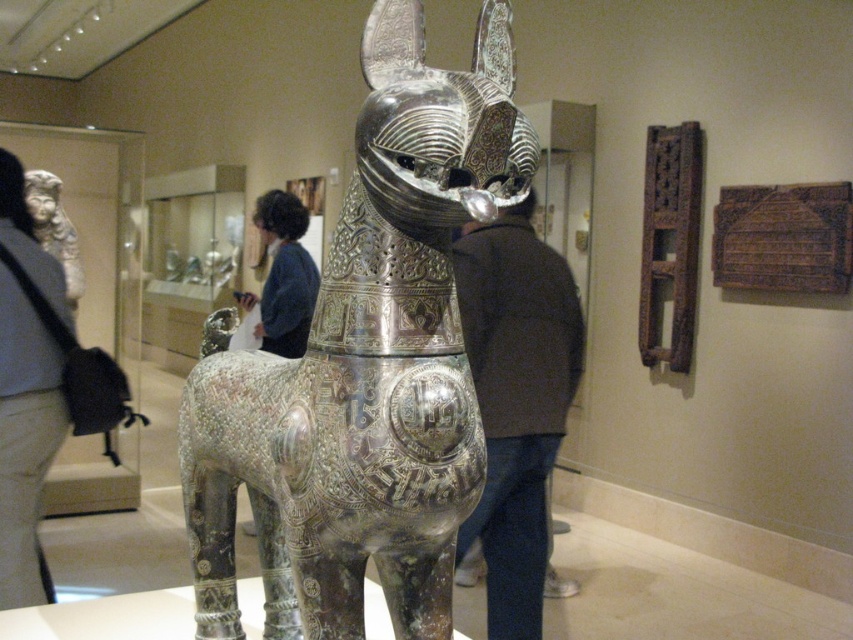
You are a GUI agent. You are given a task and a screenshot of the screen. Output one action in this format:
    pyautogui.click(x=<x>, y=<y>)
    Task: Click on the dark brown leather jacket at center
    
    Given the screenshot: What is the action you would take?
    pyautogui.click(x=515, y=401)

Can you confirm if dark brown leather jacket at center is thinner than light gray fabric jacket at upper left?

Incorrect, dark brown leather jacket at center's width is not less than light gray fabric jacket at upper left's.

This screenshot has width=853, height=640. Find the location of `dark brown leather jacket at center`. dark brown leather jacket at center is located at coordinates (515, 401).

Does dark brown leather jacket at center appear over dark blue sweater at center?

No.

From the picture: Can you confirm if dark brown leather jacket at center is positioned below dark blue sweater at center?

Yes, dark brown leather jacket at center is below dark blue sweater at center.

Who is more forward, (538, 627) or (276, 280)?

Point (538, 627) is more forward.

What are the coordinates of `dark brown leather jacket at center` in the screenshot? It's located at tap(515, 401).

From the picture: Which is more to the left, light gray fabric jacket at upper left or dark blue sweater at center?

Positioned to the left is light gray fabric jacket at upper left.

Can you confirm if light gray fabric jacket at upper left is positioned to the left of dark blue sweater at center?

Correct, you'll find light gray fabric jacket at upper left to the left of dark blue sweater at center.

This screenshot has height=640, width=853. I want to click on light gray fabric jacket at upper left, so click(25, 440).